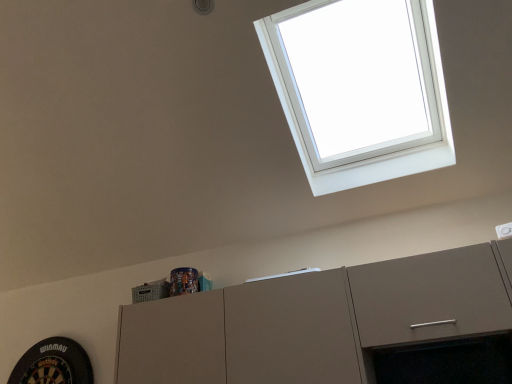
Question: Is white plastic window at upper right spatially inside matte gray cabinet at upper center, or outside of it?

Choices:
 (A) inside
 (B) outside

Answer: (B)

Question: Based on their sizes in the image, would you say white plastic window at upper right is bigger or smaller than matte gray cabinet at upper center?

Choices:
 (A) big
 (B) small

Answer: (A)

Question: Is white plastic window at upper right wider or thinner than matte gray cabinet at upper center?

Choices:
 (A) thin
 (B) wide

Answer: (B)

Question: Based on their positions, is matte gray cabinet at upper center located to the left or right of white plastic window at upper right?

Choices:
 (A) right
 (B) left

Answer: (B)

Question: Is matte gray cabinet at upper center wider or thinner than white plastic window at upper right?

Choices:
 (A) wide
 (B) thin

Answer: (B)

Question: In terms of size, does matte gray cabinet at upper center appear bigger or smaller than white plastic window at upper right?

Choices:
 (A) big
 (B) small

Answer: (B)

Question: From the image's perspective, is matte gray cabinet at upper center above or below white plastic window at upper right?

Choices:
 (A) above
 (B) below

Answer: (B)